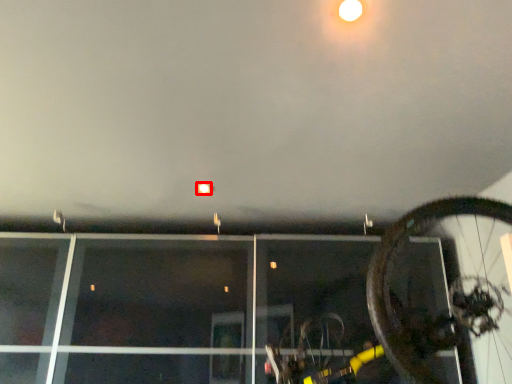
Question: From the image's perspective, where is droplight (annotated by the red box) located in relation to bicycle in the image?

Choices:
 (A) above
 (B) below

Answer: (A)